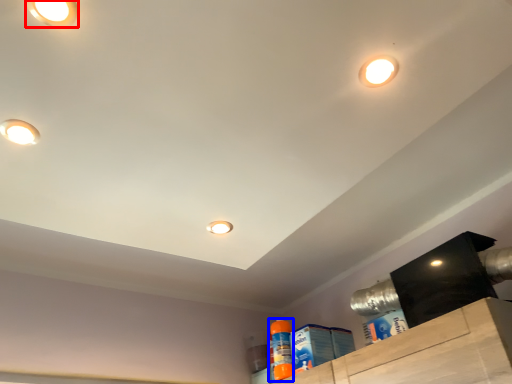
Question: Which of the following is the farthest to the observer, droplight (highlighted by a red box) or cleaning product (highlighted by a blue box)?

Choices:
 (A) droplight
 (B) cleaning product

Answer: (B)